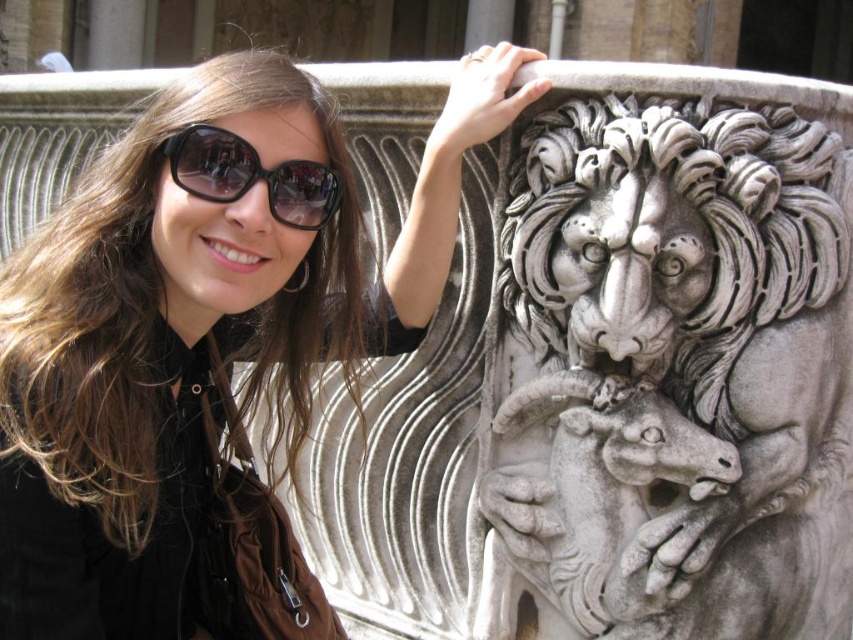
You are standing in front of the stone sculpture and want to touch both the matte black jacket at upper left and the stone sculpture. Which one can you reach first if you move directly towards the sculpture?

Since the matte black jacket at upper left and the stone sculpture are 14.85 meters apart, you would reach the stone sculpture first as you are moving directly towards it, while the jacket is further away at 14.85 meters.

In the scene shown: You are an artist trying to sketch the scene. You notice the white marble lion at upper center and the black glossy sunglasses at upper center. Which object should you draw first if you want to capture the one that is higher up?

The white marble lion at upper center should be drawn first because it is taller than the black glossy sunglasses at upper center.